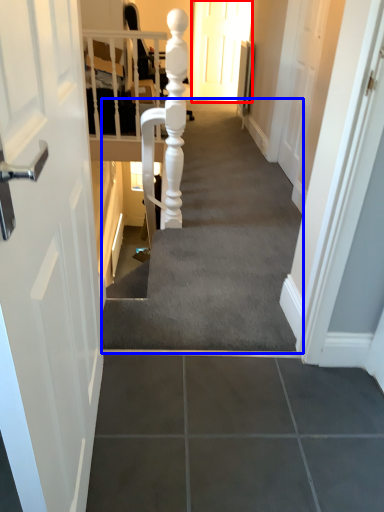
Question: Among these objects, which one is nearest to the camera, door (highlighted by a red box) or stairwell (highlighted by a blue box)?

Choices:
 (A) door
 (B) stairwell

Answer: (B)